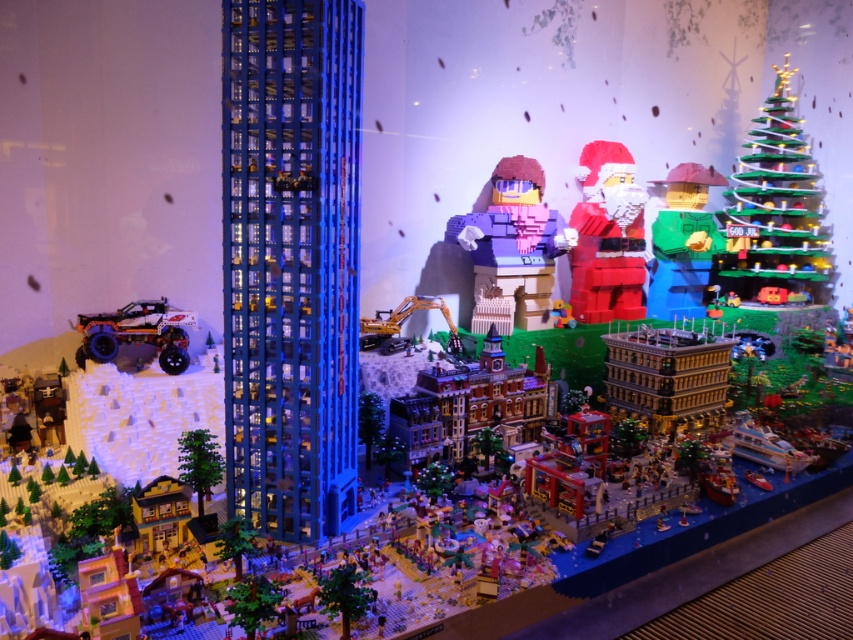
Looking at this image, can you confirm if matte pink plastic minifigure at center is wider than green matte figure at center-right?

Yes.

This screenshot has width=853, height=640. Describe the element at coordinates (512, 248) in the screenshot. I see `matte pink plastic minifigure at center` at that location.

Which is in front, point (547, 221) or point (701, 292)?

Point (547, 221) is more forward.

Locate an element on the screen. This screenshot has height=640, width=853. matte pink plastic minifigure at center is located at coordinates (512, 248).

Is matte red santa at center bigger than shiny metallic car at left?

Yes.

Can you confirm if matte red santa at center is smaller than shiny metallic car at left?

Incorrect, matte red santa at center is not smaller in size than shiny metallic car at left.

Where is `matte red santa at center`? matte red santa at center is located at coordinates (607, 236).

Is green matte figure at center-right positioned in front of shiny metallic car at left?

No, it is not.

Is point (699, 179) positioned in front of point (119, 321)?

No.

This screenshot has width=853, height=640. Find the location of `green matte figure at center-right`. green matte figure at center-right is located at coordinates (683, 243).